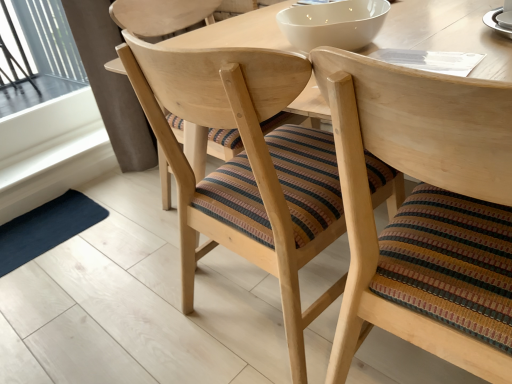
I want to click on free space that is in between wooden chair with striped cushion at center, which is counted as the second chair, starting from the right, and dark blue fabric mat at lower left, so click(x=122, y=273).